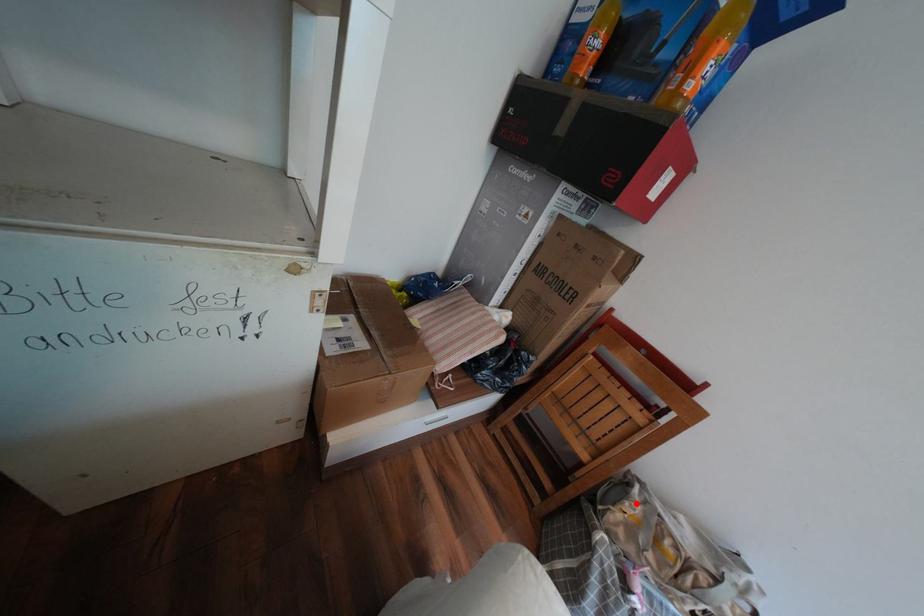
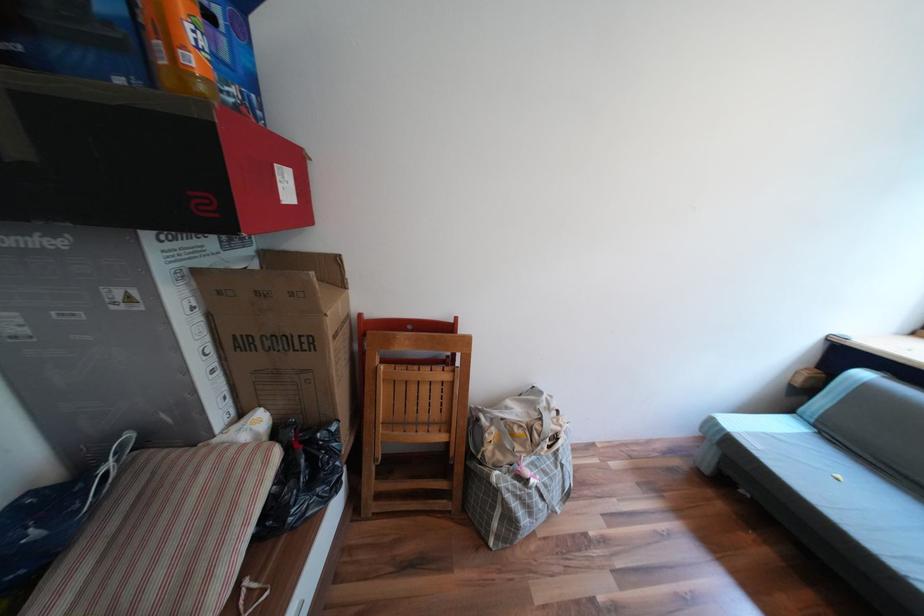
Question: I am providing you with two images of the same scene from different viewpoints. A red point is marked on the first image. Can you still see the location of the red point in image 2?

Choices:
 (A) Yes
 (B) No

Answer: (A)